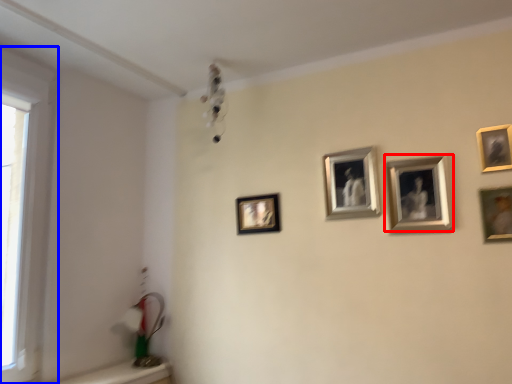
Question: Which point is closer to the camera, picture frame (highlighted by a red box) or window (highlighted by a blue box)?

Choices:
 (A) picture frame
 (B) window

Answer: (B)